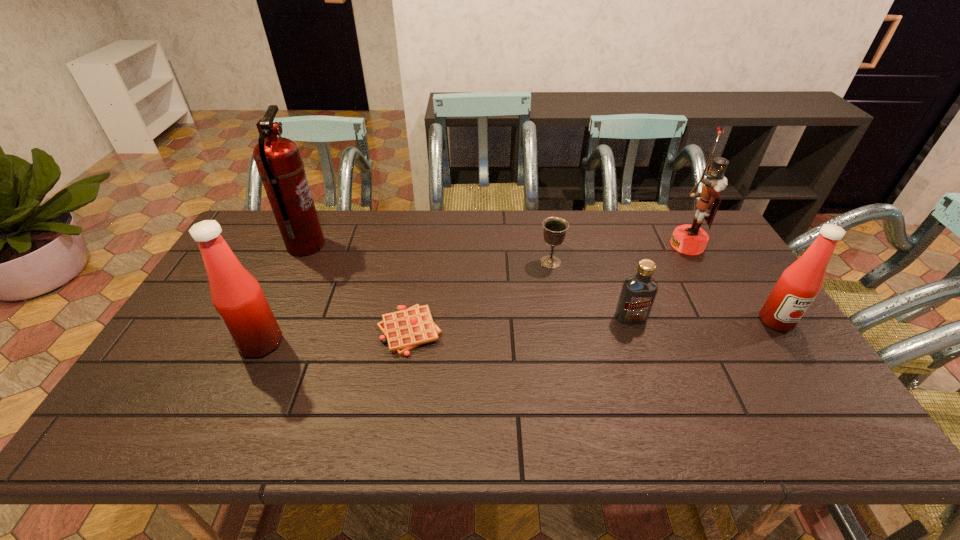
Locate an element on the screen. This screenshot has width=960, height=540. unoccupied area between the fire extinguisher and the second object from right to left is located at coordinates (496, 245).

Where is `vacant area that lies between the nutcracker and the fire extinguisher`? The height and width of the screenshot is (540, 960). vacant area that lies between the nutcracker and the fire extinguisher is located at coordinates (496, 245).

Identify which object is the fourth closest to the fourth object from left to right. Please provide its 2D coordinates. Your answer should be formatted as a tuple, i.e. [(x, y)], where the tuple contains the x and y coordinates of a point satisfying the conditions above.

[(799, 284)]

Identify which object is located as the second nearest to the shortest object. Please provide its 2D coordinates. Your answer should be formatted as a tuple, i.e. [(x, y)], where the tuple contains the x and y coordinates of a point satisfying the conditions above.

[(278, 160)]

At what (x,y) coordinates should I click in order to perform the action: click on vacant region that satisfies the following two spatial constraints: 1. on the side of the fire extinguisher with the handle and hose; 2. on the back side of the sixth tallest object. Please return your answer as a coordinate pair (x, y). Looking at the image, I should click on (298, 262).

Image resolution: width=960 pixels, height=540 pixels. Identify the location of vacant area in the image that satisfies the following two spatial constraints: 1. on the side of the fire extinguisher with the handle and hose; 2. on the left side of the fifth object from right to left. (265, 331).

Identify the location of vacant area in the image that satisfies the following two spatial constraints: 1. on the front-facing side of the nutcracker; 2. on the front side of the shortest object. The height and width of the screenshot is (540, 960). (735, 331).

Locate an element on the screen. free space that satisfies the following two spatial constraints: 1. on the side of the fire extinguisher with the handle and hose; 2. on the right side of the second shortest object is located at coordinates (298, 262).

Image resolution: width=960 pixels, height=540 pixels. Identify the location of free space that satisfies the following two spatial constraints: 1. on the front-facing side of the fifth tallest object; 2. on the front-facing side of the taller condiment. (639, 343).